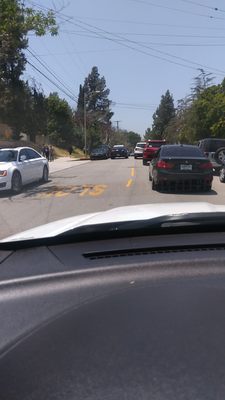
Where is `paint`? paint is located at coordinates (93, 184).